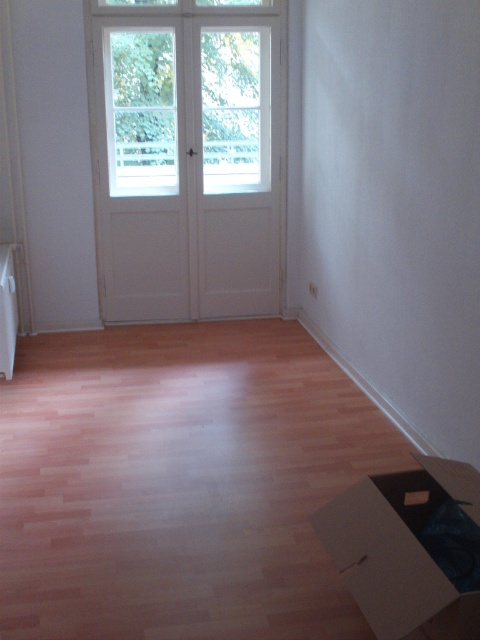
Who is more forward, (168,97) or (474,596)?

Positioned in front is point (474,596).

Is point (218, 148) farther from camera compared to point (414, 474)?

Yes, it is behind point (414, 474).

Is point (190, 33) positioned behind point (393, 592)?

Yes, point (190, 33) is farther from viewer.

Where is `white wooden door at upper center`? white wooden door at upper center is located at coordinates (186, 93).